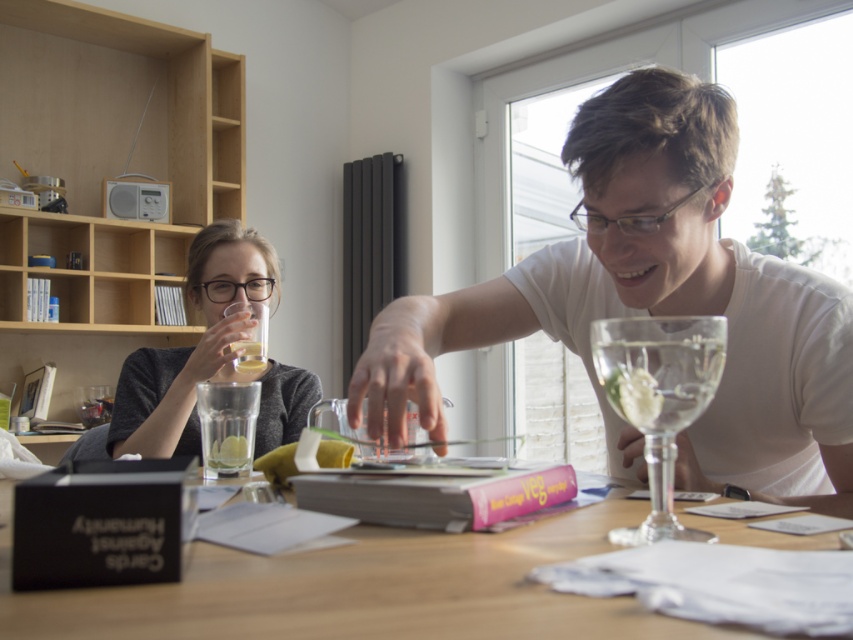
Question: Where is clear glass at center located in relation to green translucent lime at center in the image?

Choices:
 (A) right
 (B) left

Answer: (B)

Question: Among these points, which one is nearest to the camera?

Choices:
 (A) (641, 342)
 (B) (646, 177)
 (C) (285, 576)
 (D) (244, 442)

Answer: (C)

Question: Based on their relative distances, which object is farther from the wooden table at center?

Choices:
 (A) clear glass at center
 (B) white matte glass at center
 (C) matte gray sweater at left

Answer: (C)

Question: Can you confirm if matte gray sweater at left is wider than yellow translucent lemon at upper center?

Choices:
 (A) yes
 (B) no

Answer: (A)

Question: Among these objects, which one is nearest to the camera?

Choices:
 (A) clear glass at center
 (B) translucent glass at upper center

Answer: (A)

Question: In this image, where is clear glass wine glass at right located relative to clear glass at center?

Choices:
 (A) left
 (B) right

Answer: (B)